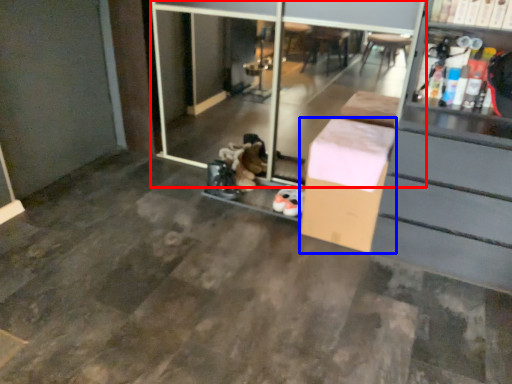
Question: Which object appears farthest to the camera in this image, screen door (highlighted by a red box) or box (highlighted by a blue box)?

Choices:
 (A) screen door
 (B) box

Answer: (B)